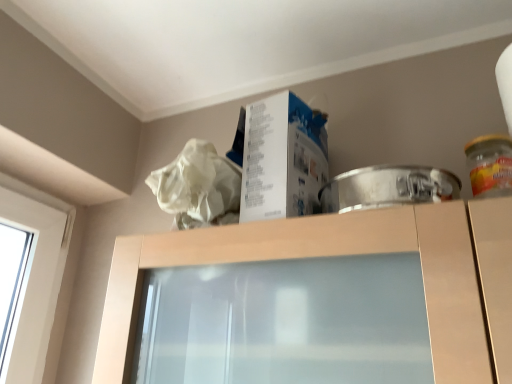
Question: Is white paperboard box at upper center taller or shorter than translucent glass jar at right?

Choices:
 (A) short
 (B) tall

Answer: (B)

Question: From a real-world perspective, is white paperboard box at upper center positioned above or below translucent glass jar at right?

Choices:
 (A) below
 (B) above

Answer: (B)

Question: Which is correct: white paperboard box at upper center is inside translucent glass jar at right, or outside of it?

Choices:
 (A) outside
 (B) inside

Answer: (A)

Question: Is translucent glass jar at right bigger or smaller than white paperboard box at upper center?

Choices:
 (A) small
 (B) big

Answer: (A)

Question: From the image's perspective, relative to white paperboard box at upper center, is translucent glass jar at right above or below?

Choices:
 (A) below
 (B) above

Answer: (A)

Question: Do you think translucent glass jar at right is within white paperboard box at upper center, or outside of it?

Choices:
 (A) inside
 (B) outside

Answer: (B)

Question: Considering the positions of translucent glass jar at right and white paperboard box at upper center in the image, is translucent glass jar at right wider or thinner than white paperboard box at upper center?

Choices:
 (A) thin
 (B) wide

Answer: (A)